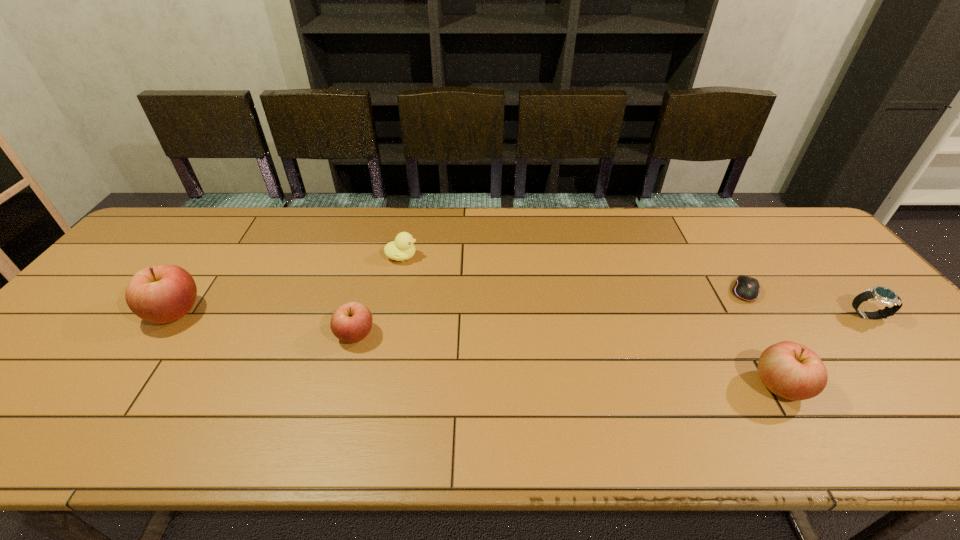
The image size is (960, 540). Identify the location of free spot at the near left corner of the desktop. click(x=25, y=391).

You are a GUI agent. You are given a task and a screenshot of the screen. Output one action in this format:
    pyautogui.click(x=<x>, y=<y>)
    Task: Click on the unoccupied position between the shortest object and the second apple from left to right
    
    Given the screenshot: What is the action you would take?
    pyautogui.click(x=550, y=313)

The width and height of the screenshot is (960, 540). I want to click on free space between the farthest object and the second apple from left to right, so click(x=378, y=296).

Identify the location of free space between the shortest apple and the shortest object. [550, 313].

Locate an element on the screen. The image size is (960, 540). vacant space in between the farthest object and the nearest apple is located at coordinates (590, 321).

Image resolution: width=960 pixels, height=540 pixels. In order to click on vacant area that lies between the rightmost apple and the shortest object in this screenshot , I will do pos(762,339).

The height and width of the screenshot is (540, 960). Find the location of `free space between the farthest object and the rightmost object`. free space between the farthest object and the rightmost object is located at coordinates (635, 287).

Locate an element on the screen. Image resolution: width=960 pixels, height=540 pixels. empty space between the second shortest apple and the shortest object is located at coordinates (762, 339).

Image resolution: width=960 pixels, height=540 pixels. In order to click on free space between the computer mouse and the shortest apple in this screenshot , I will do point(550,313).

This screenshot has width=960, height=540. I want to click on free space between the computer mouse and the second apple from left to right, so click(550, 313).